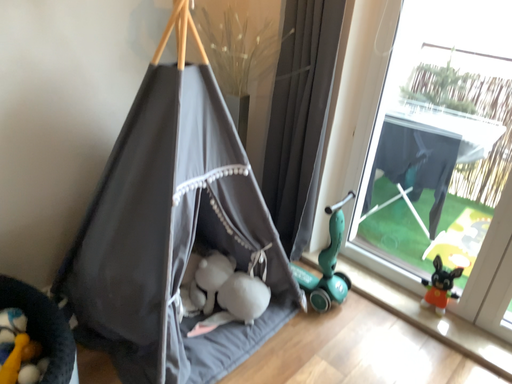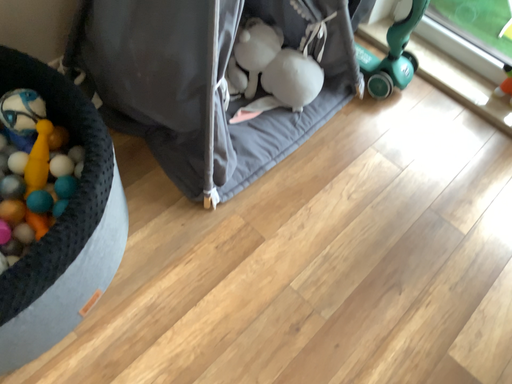
Question: Which way did the camera rotate in the video?

Choices:
 (A) rotated upward
 (B) rotated downward

Answer: (B)